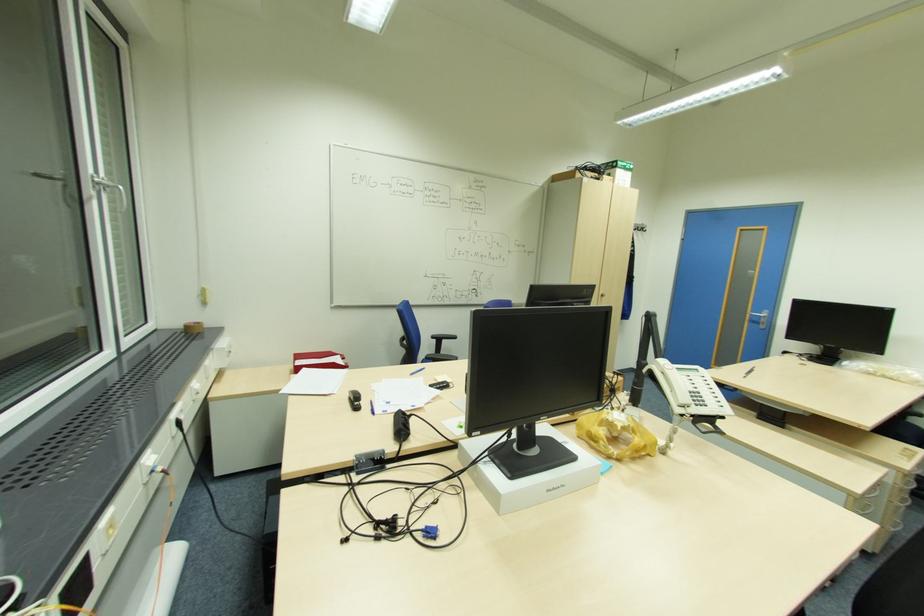
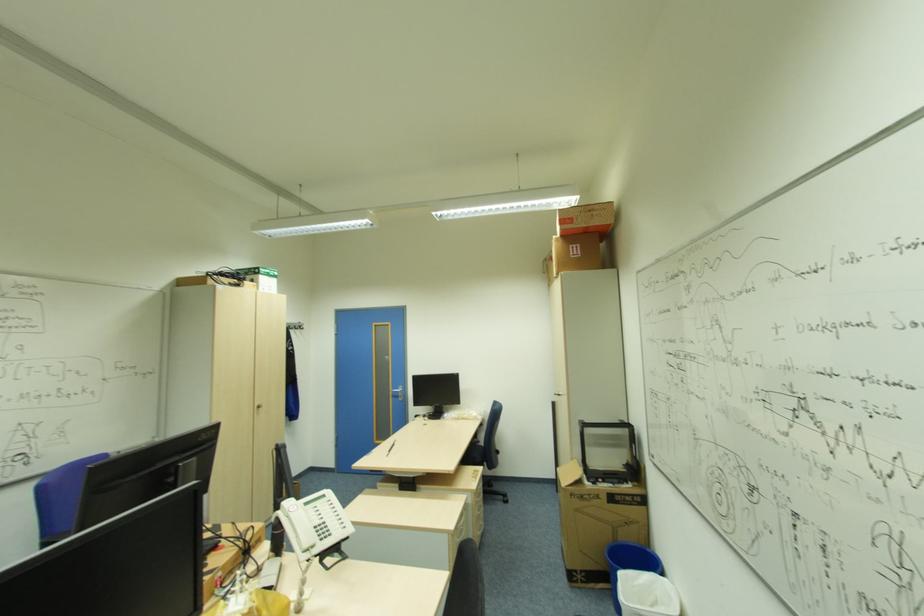
Question: The camera is either moving clockwise (left) or counter-clockwise (right) around the object. The first image is from the beginning of the video and the second image is from the end. Is the camera moving left or right when shooting the video?

Choices:
 (A) Left
 (B) Right

Answer: (A)